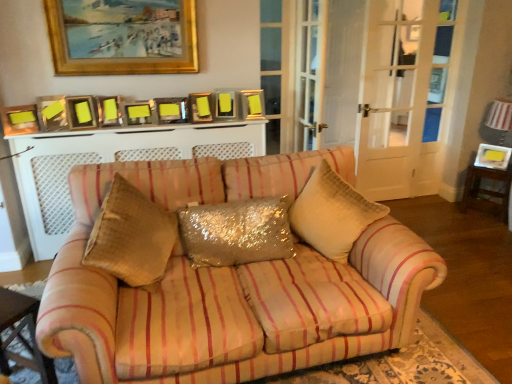
Question: Considering the relative sizes of matte gold picture frame at left, placed as the 10th picture frame when sorted from back to front, and matte gold picture frame at center, the 7th picture frame in the bottom-to-top sequence, in the image provided, is matte gold picture frame at left, placed as the 10th picture frame when sorted from back to front, shorter than matte gold picture frame at center, the 7th picture frame in the bottom-to-top sequence,?

Choices:
 (A) no
 (B) yes

Answer: (B)

Question: Considering the relative sizes of matte gold picture frame at left, which is counted as the first picture frame, starting from the left, and matte gold picture frame at center, marked as the fourth picture frame in a back-to-front arrangement, in the image provided, is matte gold picture frame at left, which is counted as the first picture frame, starting from the left, taller than matte gold picture frame at center, marked as the fourth picture frame in a back-to-front arrangement,?

Choices:
 (A) no
 (B) yes

Answer: (A)

Question: Is matte gold picture frame at center, marked as the fourth picture frame in a back-to-front arrangement, at the back of matte gold picture frame at left, which is the second picture frame from bottom to top?

Choices:
 (A) yes
 (B) no

Answer: (B)

Question: Would you say matte gold picture frame at left, which is the second picture frame from bottom to top, is outside matte gold picture frame at center, the 5th picture frame viewed from the top?

Choices:
 (A) no
 (B) yes

Answer: (B)

Question: From a real-world perspective, is matte gold picture frame at left, arranged as the 10th picture frame when viewed from the top, positioned under matte gold picture frame at center, the 7th picture frame in the bottom-to-top sequence, based on gravity?

Choices:
 (A) yes
 (B) no

Answer: (A)

Question: Can you see matte gold picture frame at left, which is counted as the first picture frame, starting from the left, touching matte gold picture frame at center, the 7th picture frame in the bottom-to-top sequence?

Choices:
 (A) no
 (B) yes

Answer: (A)

Question: From the image's perspective, does metallic gold picture frame at upper center, which is the seventh picture frame in back-to-front order, appear higher than metallic gold picture frame at center, marked as the 8th picture frame in a top-to-bottom arrangement?

Choices:
 (A) yes
 (B) no

Answer: (A)

Question: From the image's perspective, would you say metallic gold picture frame at upper center, arranged as the sixth picture frame when viewed from the top, is shown under metallic gold picture frame at center, marked as the 8th picture frame in a top-to-bottom arrangement?

Choices:
 (A) no
 (B) yes

Answer: (A)

Question: Is the position of metallic gold picture frame at upper center, the fourth picture frame from the left, more distant than that of metallic gold picture frame at center, the 6th picture frame viewed from the right?

Choices:
 (A) yes
 (B) no

Answer: (B)

Question: Considering the relative sizes of metallic gold picture frame at upper center, arranged as the sixth picture frame when viewed from the top, and metallic gold picture frame at center, marked as the fourth picture frame in a bottom-to-top arrangement, in the image provided, is metallic gold picture frame at upper center, arranged as the sixth picture frame when viewed from the top, smaller than metallic gold picture frame at center, marked as the fourth picture frame in a bottom-to-top arrangement,?

Choices:
 (A) no
 (B) yes

Answer: (A)

Question: Can metallic gold picture frame at center, marked as the fourth picture frame in a bottom-to-top arrangement, be found inside metallic gold picture frame at upper center, which is the seventh picture frame in back-to-front order?

Choices:
 (A) yes
 (B) no

Answer: (B)

Question: Is metallic gold picture frame at upper center, which is counted as the fifth picture frame, starting from the front, looking in the opposite direction of metallic gold picture frame at center, marked as the fourth picture frame in a bottom-to-top arrangement?

Choices:
 (A) no
 (B) yes

Answer: (A)

Question: Is striped fabric couch at center far away from glittery sequined pillow at center?

Choices:
 (A) yes
 (B) no

Answer: (B)